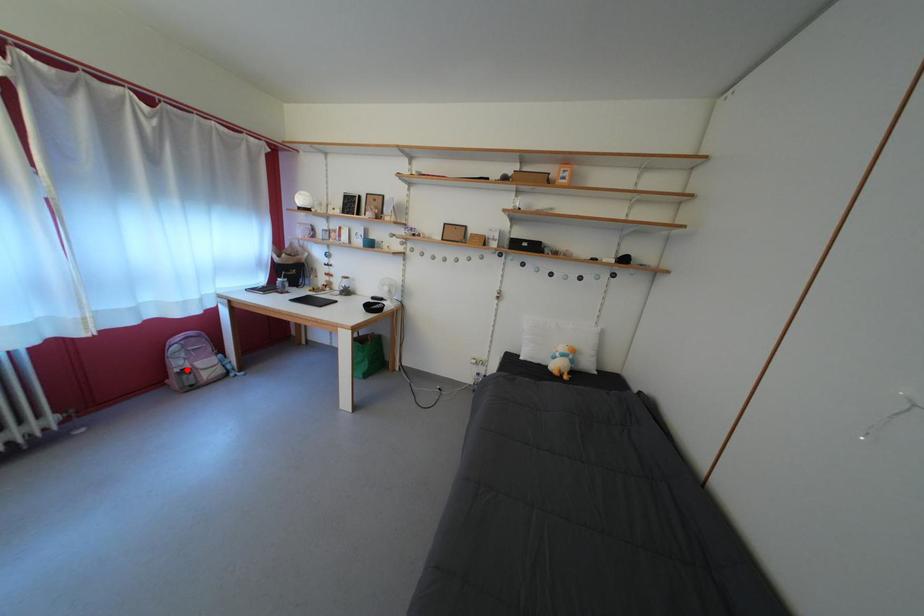
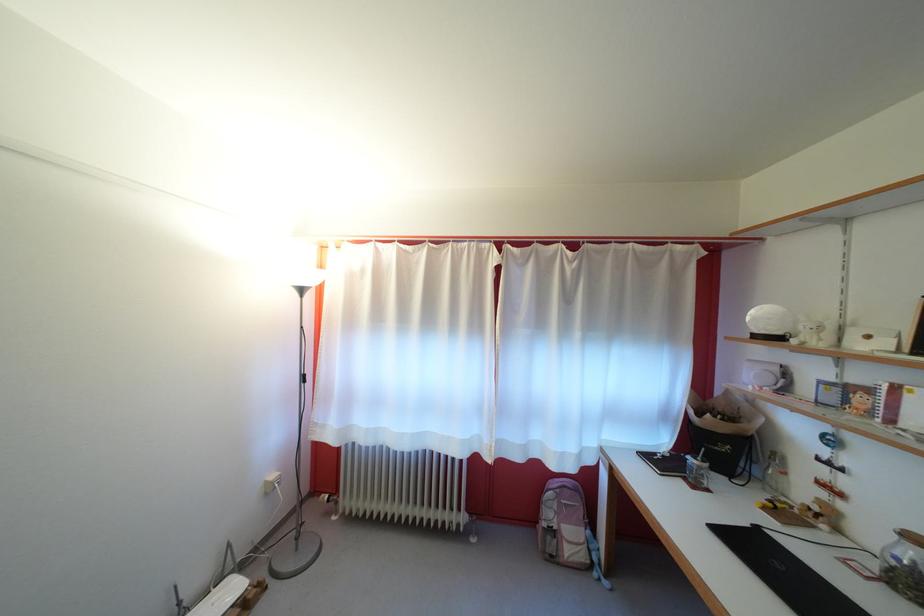
Locate, in the second image, the point that corresponds to the highlighted location in the first image.

(556, 521)